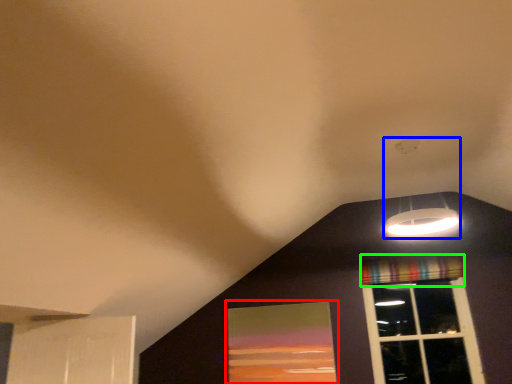
Question: Estimate the real-world distances between objects in this image. Which object is farther from window screen (highlighted by a red box), lamp (highlighted by a blue box) or curtain (highlighted by a green box)?

Choices:
 (A) lamp
 (B) curtain

Answer: (A)